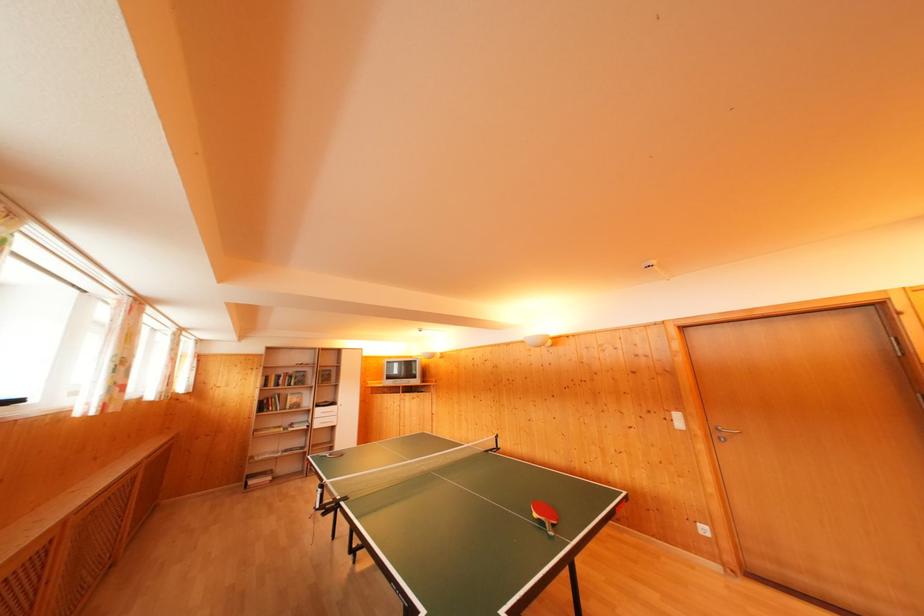
Find where to pull the white drawer handle. Please return your answer as a coordinate pair (x, y).

(324, 414)